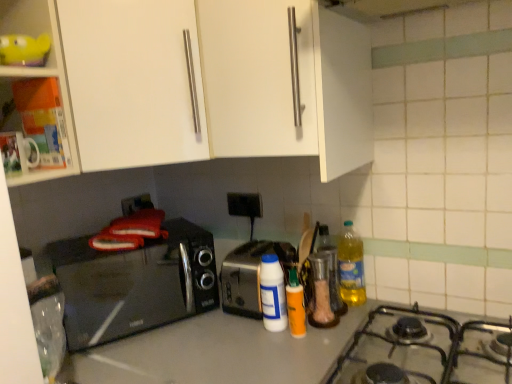
At what (x,y) coordinates should I click in order to perform the action: click on free space to the left of white plastic bottle at center, which ranks as the third bottle in right-to-left order. Please return your answer as a coordinate pair (x, y). This screenshot has height=384, width=512. Looking at the image, I should click on (220, 332).